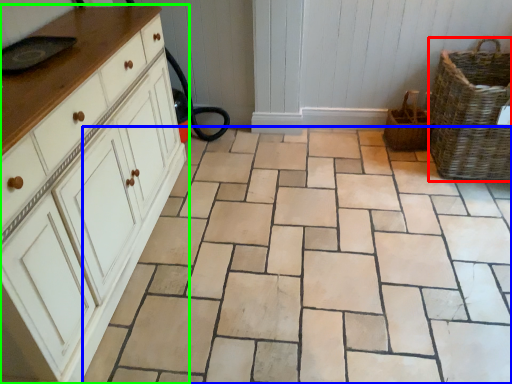
Question: Considering the real-world distances, which object is closest to basket (highlighted by a red box)? ceramic tile (highlighted by a blue box) or chest of drawers (highlighted by a green box).

Choices:
 (A) ceramic tile
 (B) chest of drawers

Answer: (A)